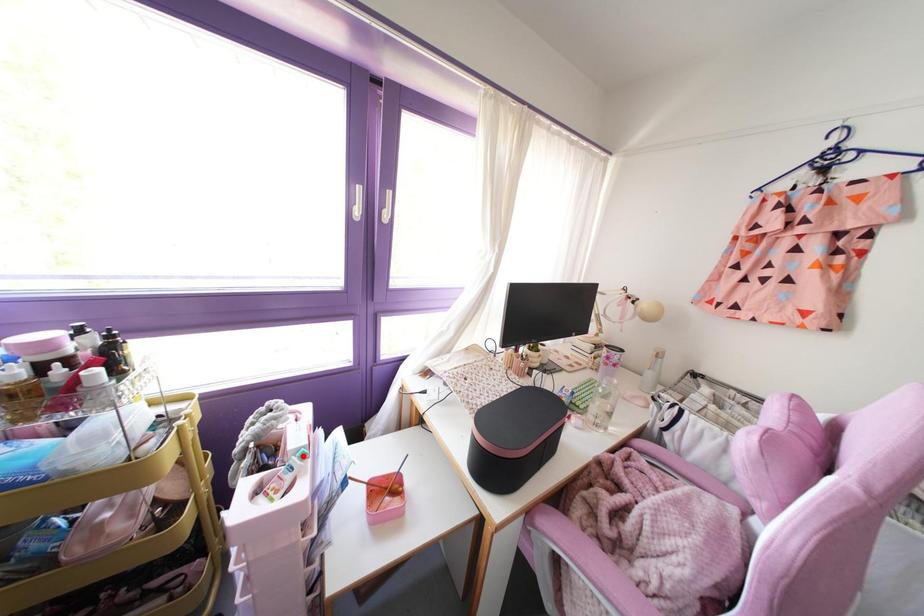
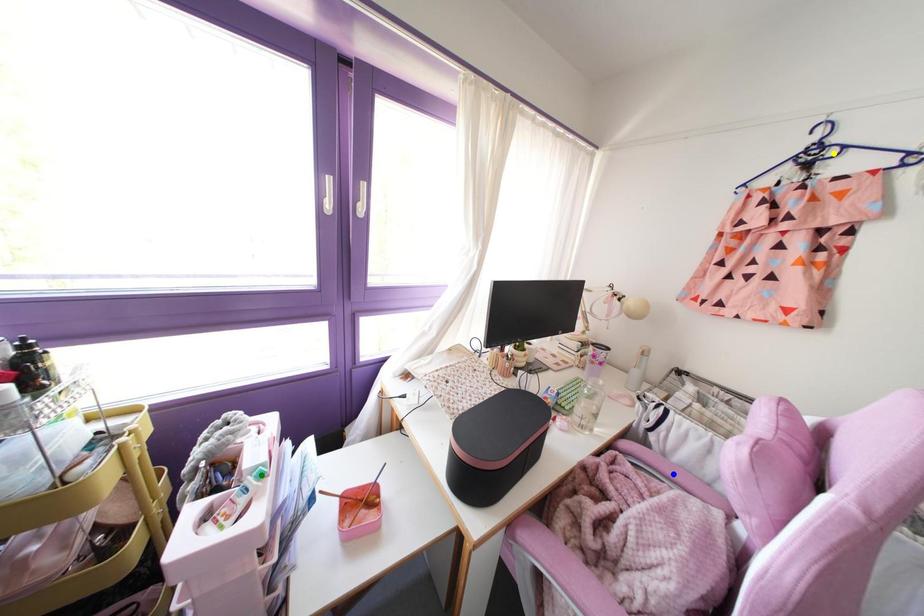
Question: I am providing you with two images of the same scene from different viewpoints. A red point is marked on the first image. You are given multiple points on the second image. In image 2, which mark is for the same physical point as the one in image 1?

Choices:
 (A) yellow point
 (B) green point
 (C) blue point

Answer: (B)